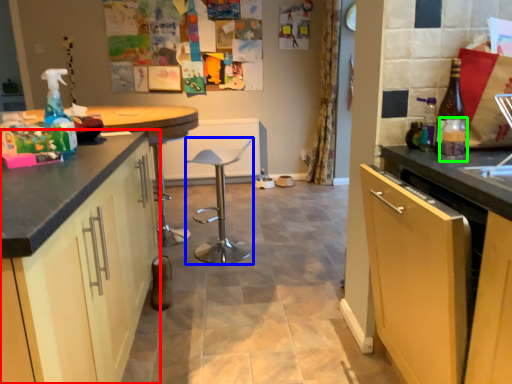
Question: Estimate the real-world distances between objects in this image. Which object is closer to cabinetry (highlighted by a red box), bar stool (highlighted by a blue box) or bottle (highlighted by a green box)?

Choices:
 (A) bar stool
 (B) bottle

Answer: (B)